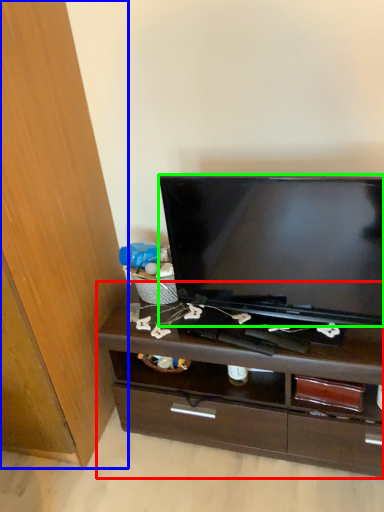
Question: Based on their relative distances, which object is farther from chest of drawers (highlighted by a red box)? Choose from cabinetry (highlighted by a blue box) and television (highlighted by a green box).

Choices:
 (A) cabinetry
 (B) television

Answer: (A)